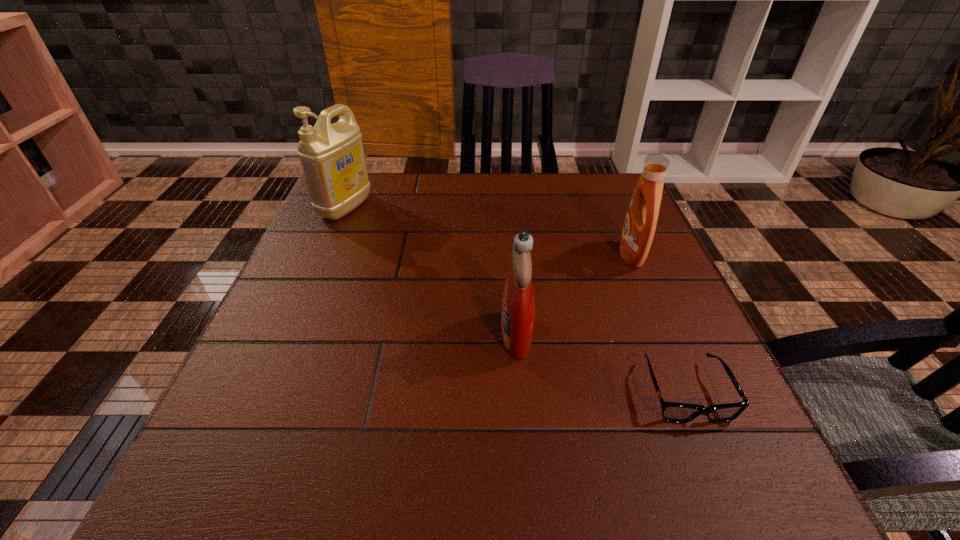
At what (x,y) coordinates should I click in order to perform the action: click on vacant point that satisfies the following two spatial constraints: 1. on the front-facing side of the second farthest object; 2. on the front-facing side of the sunglasses. Please return your answer as a coordinate pair (x, y). Looking at the image, I should click on (688, 392).

Where is `vacant region that satisfies the following two spatial constraints: 1. on the front-facing side of the second farthest object; 2. on the front-facing side of the shortest object`? This screenshot has width=960, height=540. vacant region that satisfies the following two spatial constraints: 1. on the front-facing side of the second farthest object; 2. on the front-facing side of the shortest object is located at coordinates (688, 392).

You are a GUI agent. You are given a task and a screenshot of the screen. Output one action in this format:
    pyautogui.click(x=<x>, y=<y>)
    Task: Click on the free space that satisfies the following two spatial constraints: 1. on the front-facing side of the rightmost detergent; 2. on the front-facing side of the sunglasses
    This screenshot has height=540, width=960.
    Given the screenshot: What is the action you would take?
    pyautogui.click(x=688, y=392)

This screenshot has height=540, width=960. Find the location of `vacant space that satisfies the following two spatial constraints: 1. on the front-facing side of the second farthest detergent; 2. on the front-facing side of the shortest object`. vacant space that satisfies the following two spatial constraints: 1. on the front-facing side of the second farthest detergent; 2. on the front-facing side of the shortest object is located at coordinates (688, 392).

The width and height of the screenshot is (960, 540). I want to click on vacant space that satisfies the following two spatial constraints: 1. on the front-facing side of the second farthest detergent; 2. on the front-facing side of the shortest object, so click(688, 392).